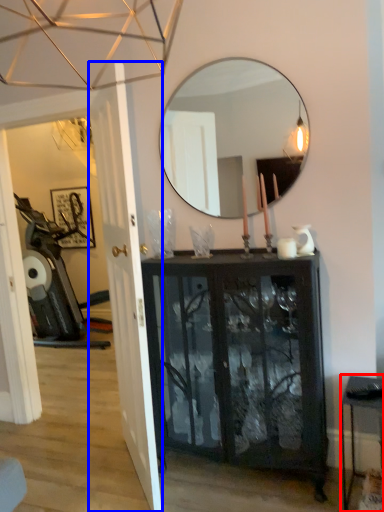
Question: Which point is further to the camera, table (highlighted by a red box) or door (highlighted by a blue box)?

Choices:
 (A) table
 (B) door

Answer: (A)